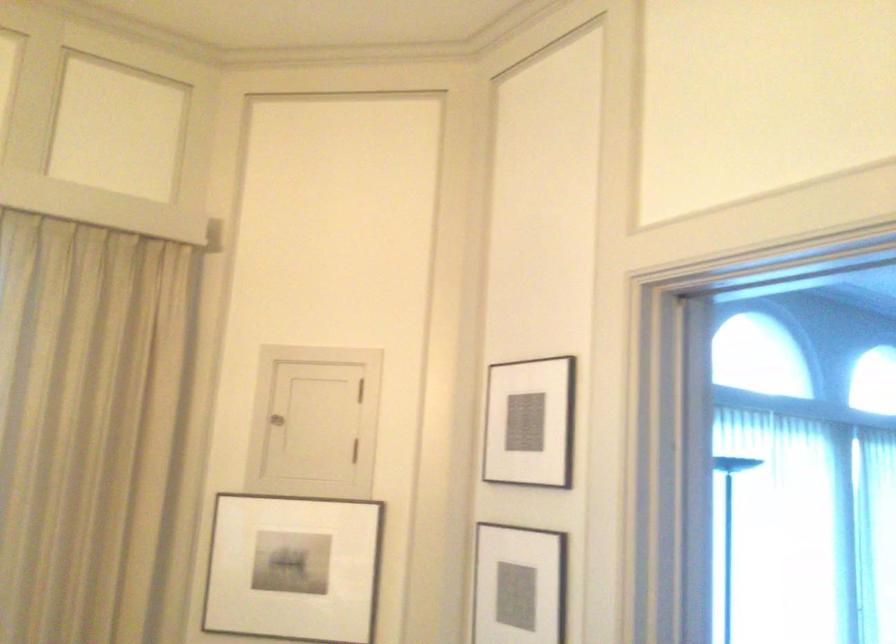
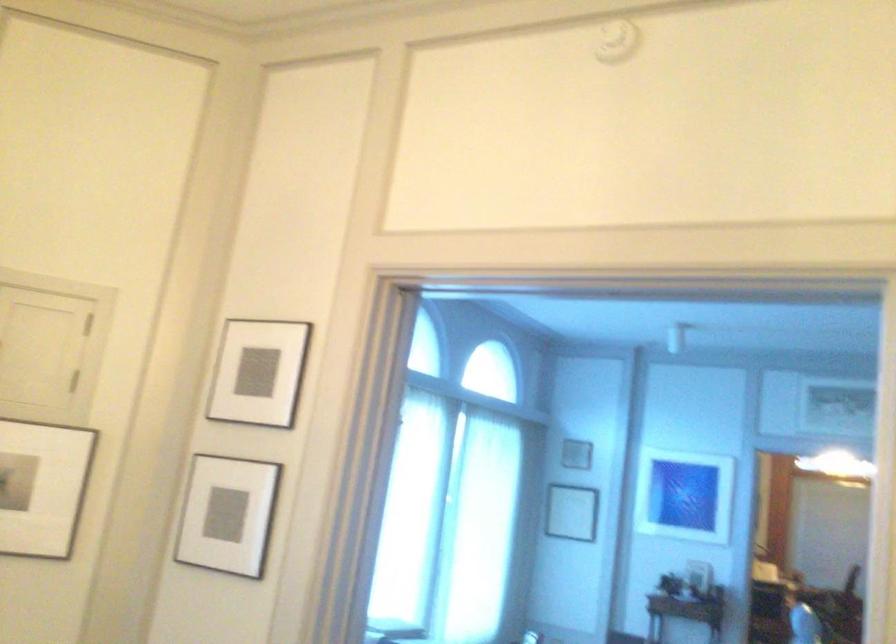
Question: The camera is either moving clockwise (left) or counter-clockwise (right) around the object. The first image is from the beginning of the video and the second image is from the end. Is the camera moving left or right when shooting the video?

Choices:
 (A) Left
 (B) Right

Answer: (A)